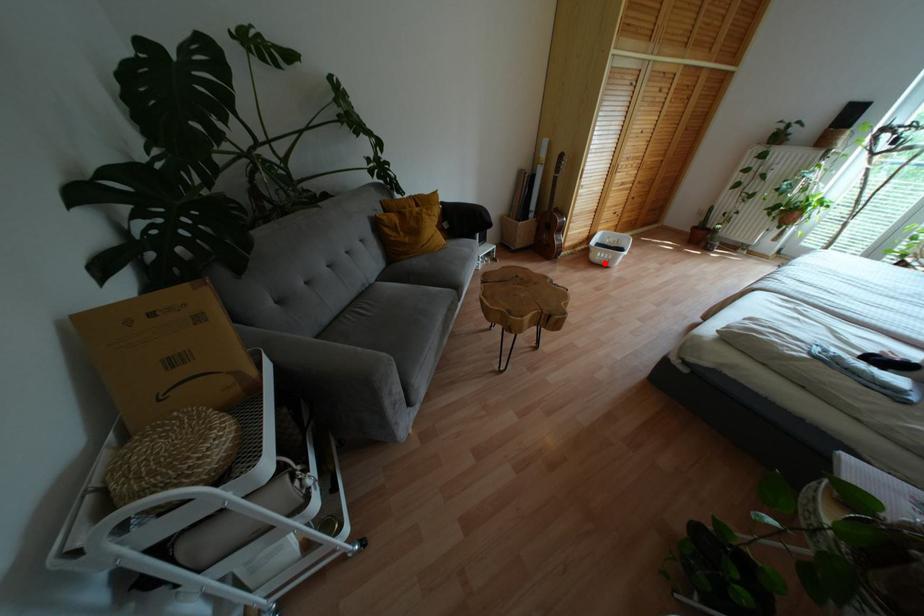
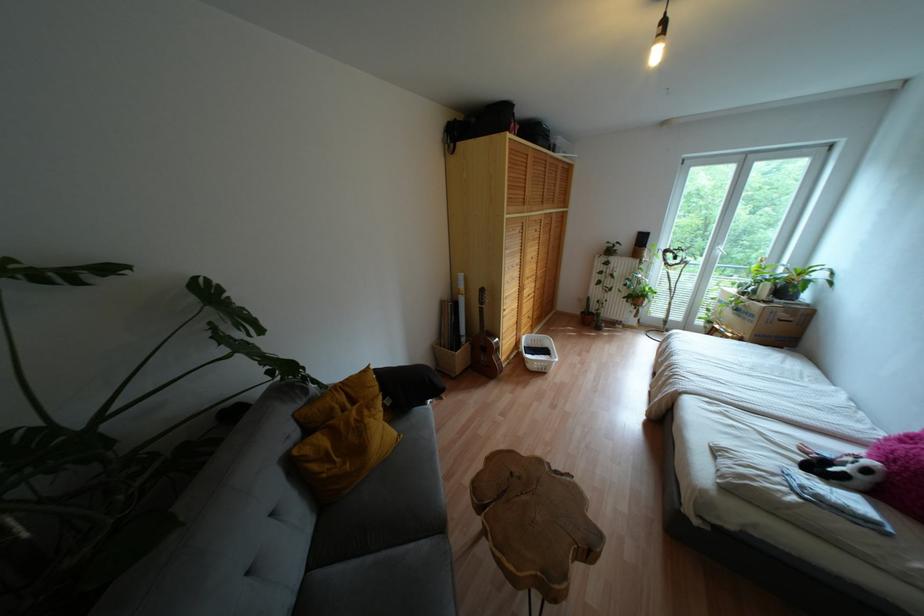
Question: I am providing you with two images of the same scene from different viewpoints. A red point is marked on the first image. At the location where the point appears in image 1, is it still visible in image 2?

Choices:
 (A) Yes
 (B) No

Answer: (A)